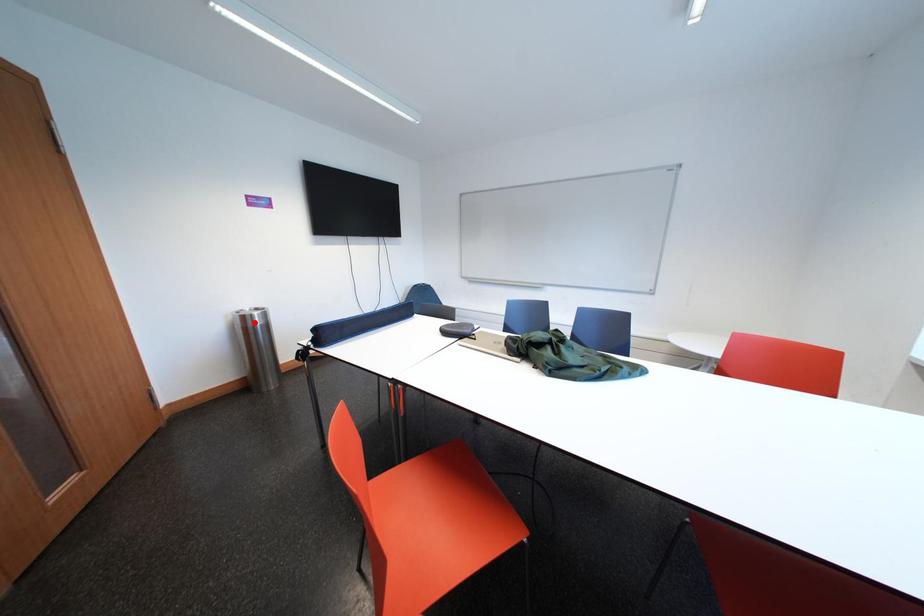
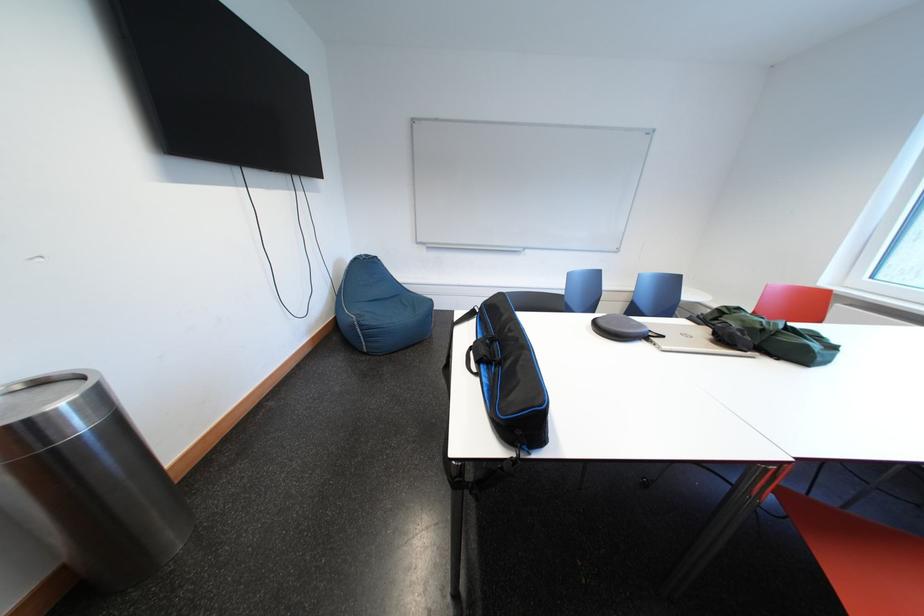
Question: I am providing you with two images of the same scene from different viewpoints. Given a red point in image1, look at the same physical point in image2. Is it:

Choices:
 (A) Closer to the viewpoint
 (B) Farther from the viewpoint

Answer: (A)